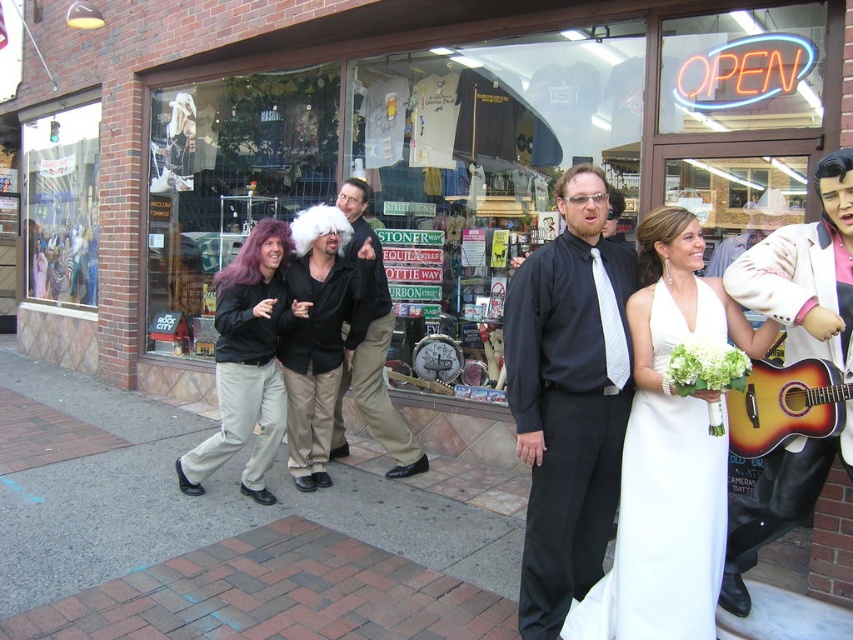
Is matte black shirt at center to the left of black matte wig at center from the viewer's perspective?

No, matte black shirt at center is not to the left of black matte wig at center.

Is matte black shirt at center in front of black matte wig at center?

That is True.

Locate an element on the screen. matte black shirt at center is located at coordinates (567, 397).

The height and width of the screenshot is (640, 853). Identify the location of matte black shirt at center. (567, 397).

Between white satin dress at center and matte plastic mannequin at upper left, which one appears on the left side from the viewer's perspective?

matte plastic mannequin at upper left is more to the left.

Where is `white satin dress at center`? The height and width of the screenshot is (640, 853). white satin dress at center is located at coordinates (662, 529).

Does matte black wig at center lie in front of white leather jacket at right?

No.

Measure the distance between matte black wig at center and camera.

matte black wig at center is 4.17 meters away from camera.

Does point (363, 344) come in front of point (825, 472)?

That is False.

At what (x,y) coordinates should I click in order to perform the action: click on matte black wig at center. Please return your answer as a coordinate pair (x, y). The image size is (853, 640). Looking at the image, I should click on (338, 340).